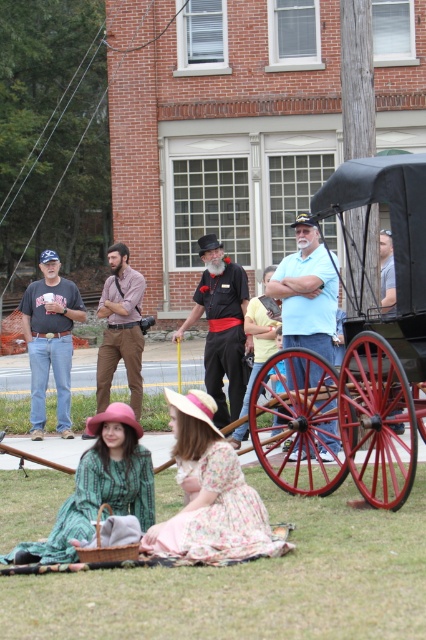
Between floral fabric dress at center and brown leather coach at center, which one is positioned higher?

brown leather coach at center is above.

Locate an element on the screen. Image resolution: width=426 pixels, height=640 pixels. floral fabric dress at center is located at coordinates (210, 493).

Does point (187, 403) lie behind point (135, 404)?

No, it is in front of (135, 404).

Identify the location of floral fabric dress at center. (210, 493).

Can you confirm if green grass at lower center is positioned to the left of matte black cup at center?

Incorrect, green grass at lower center is not on the left side of matte black cup at center.

Does green grass at lower center appear under matte black cup at center?

Correct, green grass at lower center is located below matte black cup at center.

Which is in front, point (340, 552) or point (54, 276)?

Point (340, 552)

Where is `green grass at lower center`? The width and height of the screenshot is (426, 640). green grass at lower center is located at coordinates (252, 582).

Is point (285, 614) closer to viewer compared to point (400, 326)?

Yes.

Between green grass at lower center and red wood wagon at center, which one appears on the right side from the viewer's perspective?

red wood wagon at center

Does point (218, 595) lie in front of point (307, 433)?

Yes, point (218, 595) is in front of point (307, 433).

This screenshot has width=426, height=640. What are the coordinates of `green grass at lower center` in the screenshot? It's located at (252, 582).